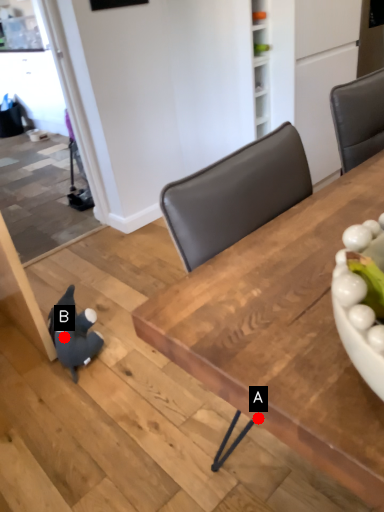
Question: Two points are circled on the image, labeled by A and B beside each circle. Which point is further to the camera?

Choices:
 (A) A is further
 (B) B is further

Answer: (B)